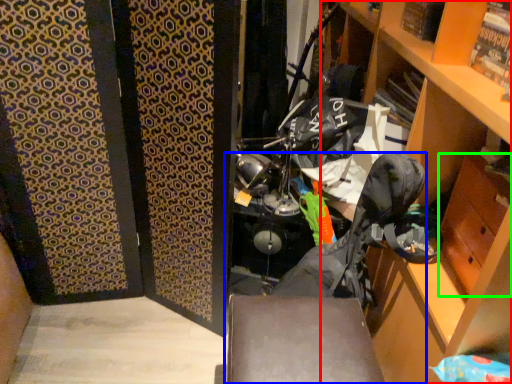
Question: Based on their relative distances, which object is nearer to cabinetry (highlighted by a red box)? Choose from folding chair (highlighted by a blue box) and drawer (highlighted by a green box).

Choices:
 (A) folding chair
 (B) drawer

Answer: (B)